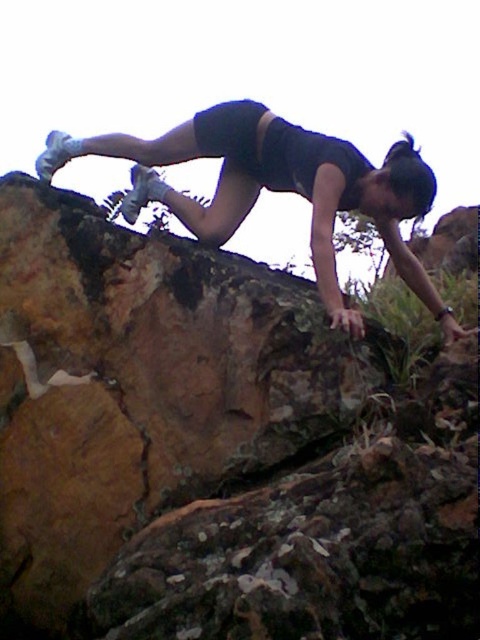
Is brown rough rock at upper left above matte black shorts at upper center?

No, brown rough rock at upper left is not above matte black shorts at upper center.

Measure the distance between brown rough rock at upper left and matte black shorts at upper center.

brown rough rock at upper left and matte black shorts at upper center are 38.98 inches apart from each other.

What do you see at coordinates (216, 448) in the screenshot? I see `brown rough rock at upper left` at bounding box center [216, 448].

The height and width of the screenshot is (640, 480). In order to click on brown rough rock at upper left in this screenshot , I will do `click(216, 448)`.